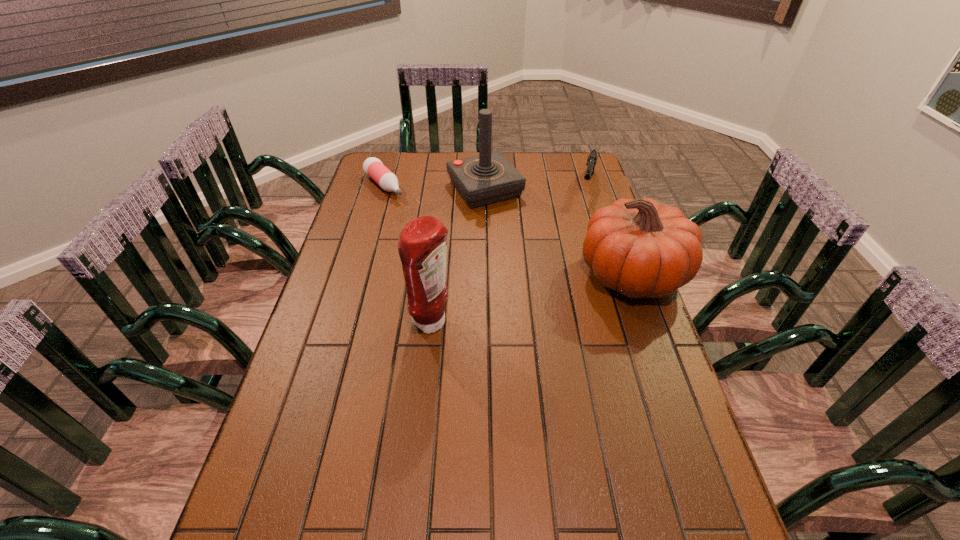
Where is `free spot on the desktop that is between the condiment and the pumpkin and is positioned on the rectangular base of the joystick`? The width and height of the screenshot is (960, 540). free spot on the desktop that is between the condiment and the pumpkin and is positioned on the rectangular base of the joystick is located at coordinates (565, 291).

You are a GUI agent. You are given a task and a screenshot of the screen. Output one action in this format:
    pyautogui.click(x=<x>, y=<y>)
    Task: Click on the free space on the desktop that is between the condiment and the pumpkin and is positioned at the end of the barrel of the gun
    The width and height of the screenshot is (960, 540).
    Given the screenshot: What is the action you would take?
    pyautogui.click(x=559, y=292)

You are a GUI agent. You are given a task and a screenshot of the screen. Output one action in this format:
    pyautogui.click(x=<x>, y=<y>)
    Task: Click on the vacant space on the desktop that is between the condiment and the third tallest object and is positioned with the cap open on the shortest object
    The image size is (960, 540).
    Given the screenshot: What is the action you would take?
    pyautogui.click(x=508, y=305)